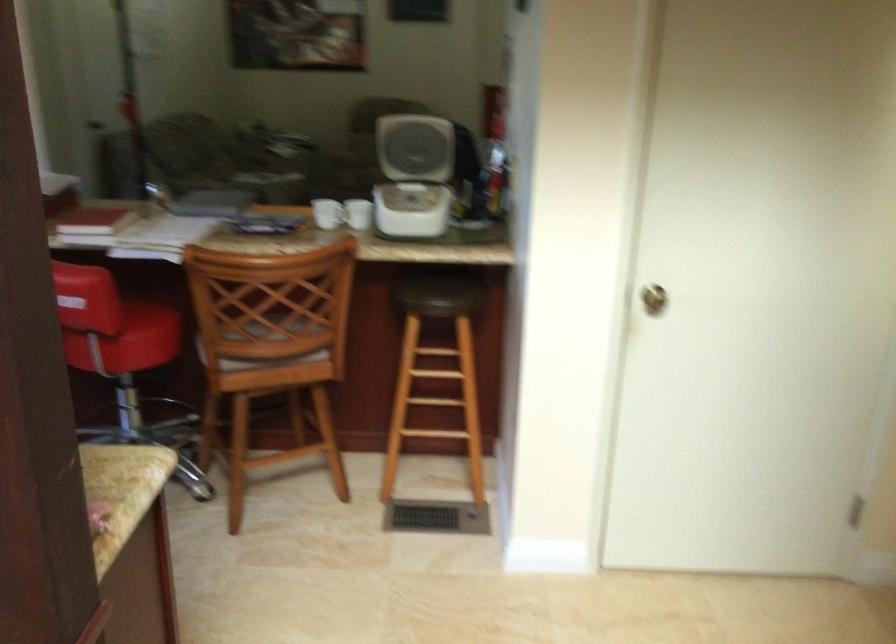
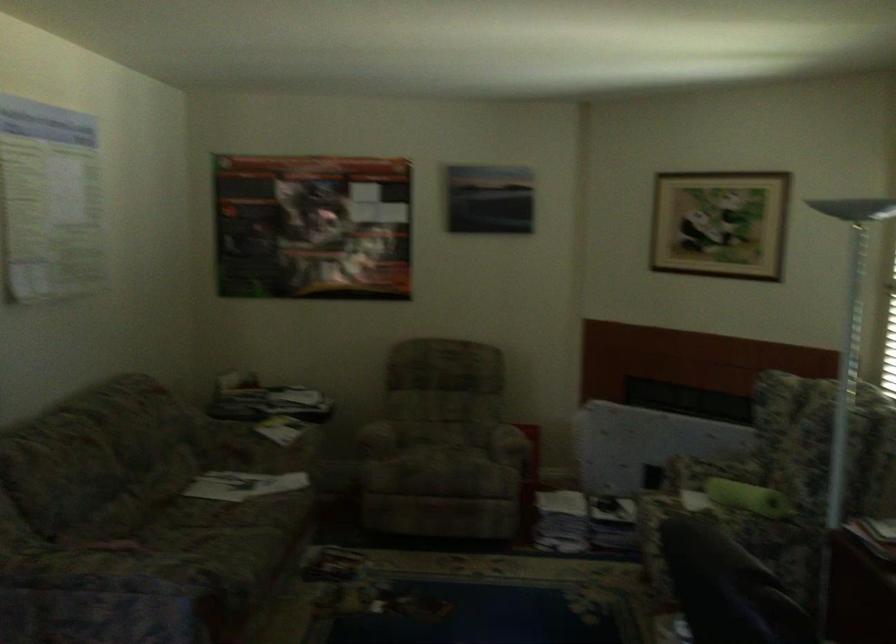
Question: Which direction would the cameraman need to move to produce the second image? Reply with the corresponding letter.

Choices:
 (A) Left
 (B) Right
 (C) Forward
 (D) Backward

Answer: (C)